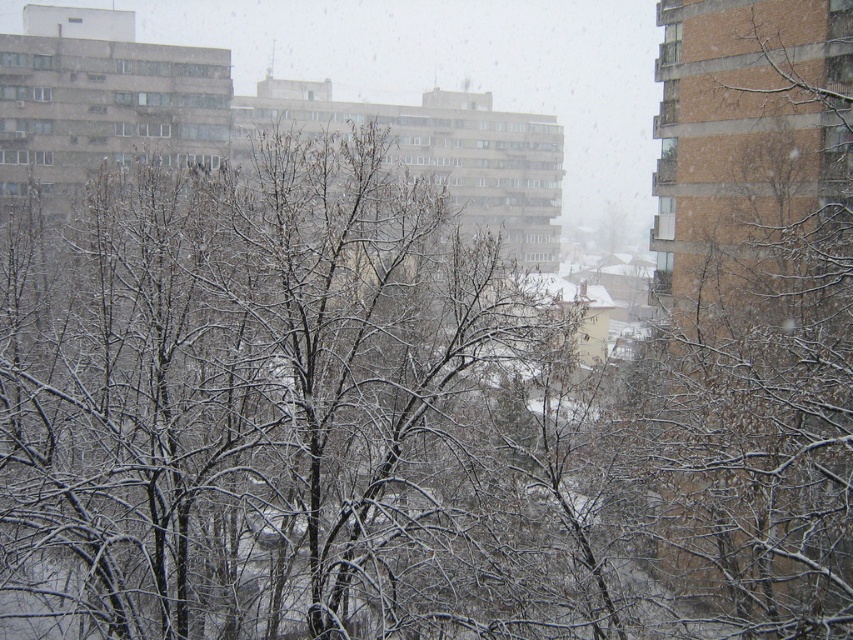
Does snow-covered branches at right appear on the right side of clear glass window at upper right?

No, snow-covered branches at right is not to the right of clear glass window at upper right.

Between snow-covered branches at right and clear glass window at upper right, which one is positioned higher?

Positioned higher is clear glass window at upper right.

Who is more forward, (x=807, y=80) or (x=666, y=49)?

Positioned in front is point (x=807, y=80).

Where is `snow-covered branches at right`? The width and height of the screenshot is (853, 640). snow-covered branches at right is located at coordinates (757, 312).

Can you confirm if clear glass window at upper right is bigger than transparent glass window at upper left?

Correct, clear glass window at upper right is larger in size than transparent glass window at upper left.

Can you confirm if clear glass window at upper right is smaller than transparent glass window at upper left?

Actually, clear glass window at upper right might be larger than transparent glass window at upper left.

Identify the location of clear glass window at upper right. The image size is (853, 640). (670, 44).

From the picture: Who is positioned more to the left, snow-covered branches at right or transparent glass window at upper left?

transparent glass window at upper left is more to the left.

Is snow-covered branches at right shorter than transparent glass window at upper left?

Incorrect, snow-covered branches at right's height does not fall short of transparent glass window at upper left's.

Where is `snow-covered branches at right`? The width and height of the screenshot is (853, 640). snow-covered branches at right is located at coordinates (757, 312).